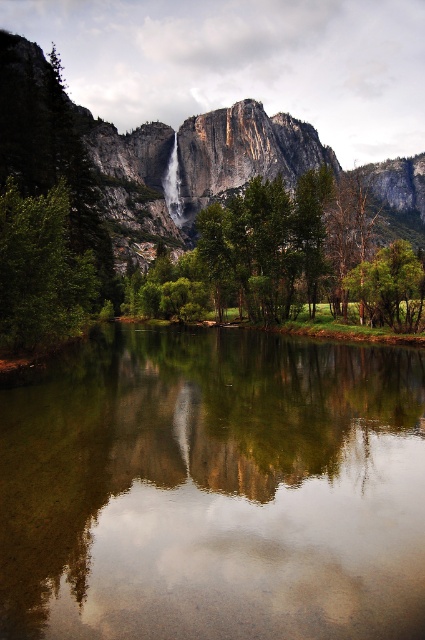
You are standing at the edge of the green reflective water at center and looking towards the rocky cliff at center. Which object is taller?

The rocky cliff at center is taller than the green reflective water at center.

You are standing at the edge of the green reflective water at center and want to throw a stone to hit the rocky cliff at center. Considering their sizes, which one would require more force to hit accurately?

The rocky cliff at center is larger than the green reflective water at center, so it would require less force to hit accurately because it has a bigger target area. The green reflective water at center is smaller, making it harder to hit and needing more precise force.